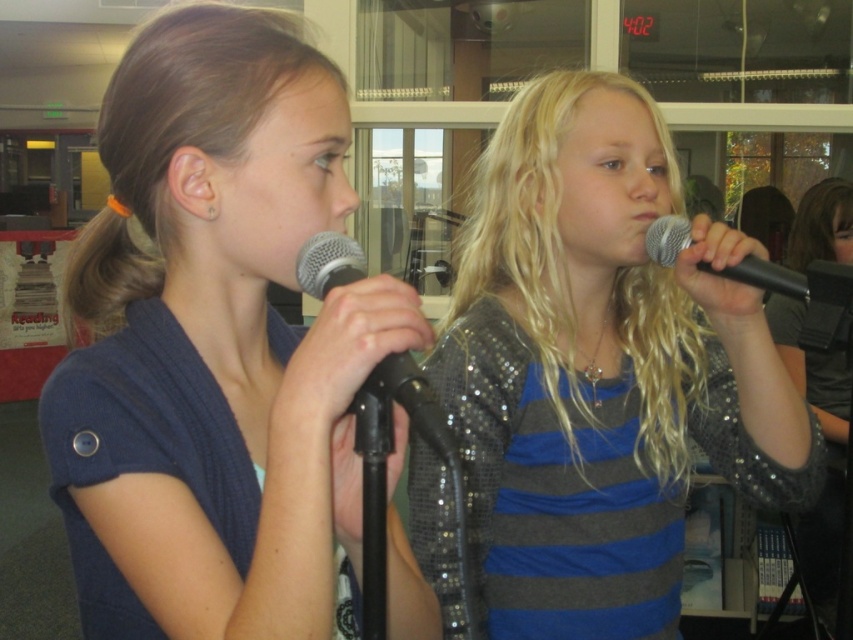
Is shiny sequined dress at right positioned before silver metallic microphone at center?

No, it is behind silver metallic microphone at center.

Can you confirm if shiny sequined dress at right is positioned below silver metallic microphone at center?

Yes.

Where is `shiny sequined dress at right`? The width and height of the screenshot is (853, 640). shiny sequined dress at right is located at coordinates (827, 444).

Does shiny sequined top at center have a larger size compared to silver metallic microphone at center?

Indeed, shiny sequined top at center has a larger size compared to silver metallic microphone at center.

Can you confirm if shiny sequined top at center is positioned above silver metallic microphone at center?

No, shiny sequined top at center is not above silver metallic microphone at center.

Between point (669, 289) and point (361, 412), which one is positioned behind?

The point (669, 289) is behind.

The width and height of the screenshot is (853, 640). Find the location of `shiny sequined top at center`. shiny sequined top at center is located at coordinates (601, 371).

Does matte blue shirt at left have a greater height compared to shiny sequined dress at right?

In fact, matte blue shirt at left may be shorter than shiny sequined dress at right.

Measure the distance from matte blue shirt at left to shiny sequined dress at right.

6.19 feet

Who is more forward, (134, 252) or (816, 508)?

Point (134, 252) is more forward.

The height and width of the screenshot is (640, 853). Identify the location of matte blue shirt at left. (216, 344).